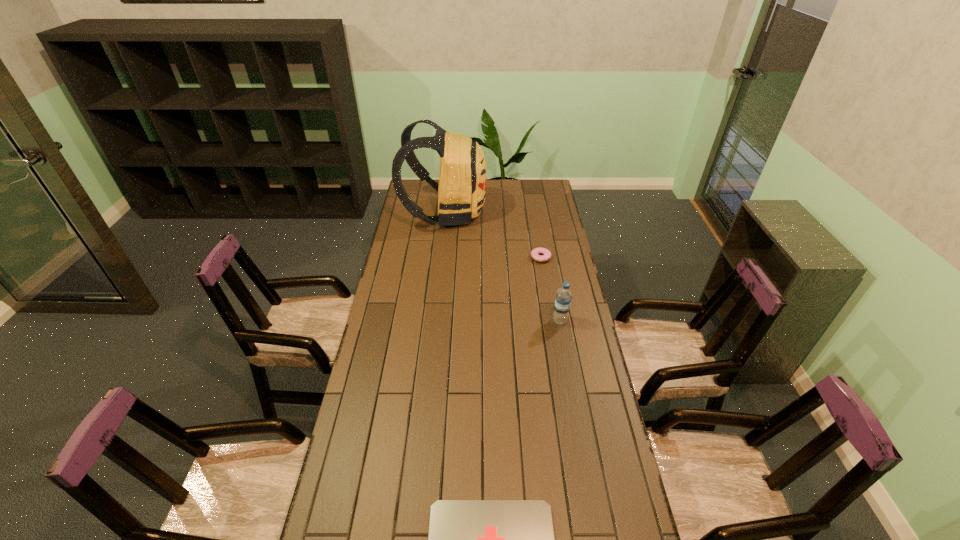
In order to click on vacant space located on the back of the doughnut in this screenshot , I will do `click(535, 221)`.

You are a GUI agent. You are given a task and a screenshot of the screen. Output one action in this format:
    pyautogui.click(x=<x>, y=<y>)
    Task: Click on the object that is at the far edge
    
    Given the screenshot: What is the action you would take?
    pyautogui.click(x=461, y=189)

Where is `object present at the left edge`? object present at the left edge is located at coordinates (461, 189).

Find the location of a particular element. This screenshot has height=540, width=960. water bottle at the right edge is located at coordinates (x=563, y=299).

This screenshot has width=960, height=540. I want to click on doughnut present at the right edge, so point(545,256).

Where is `object that is positioned at the far left corner`? object that is positioned at the far left corner is located at coordinates (461, 189).

This screenshot has height=540, width=960. Find the location of `vacant position at the far edge of the desktop`. vacant position at the far edge of the desktop is located at coordinates (501, 192).

At what (x,y) coordinates should I click in order to perform the action: click on free location at the left edge of the desktop. Please return your answer as a coordinate pair (x, y). Looking at the image, I should click on (380, 400).

Identify the location of vacant space at the right edge. This screenshot has width=960, height=540. (597, 489).

Where is `vacant space at the far left corner of the desktop`? This screenshot has height=540, width=960. vacant space at the far left corner of the desktop is located at coordinates (434, 202).